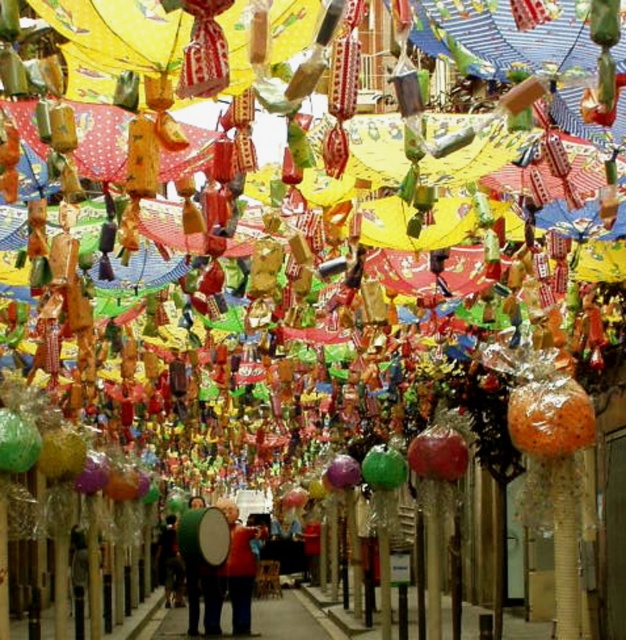
You are standing in the middle of the street looking up at the decorations. Which object is closer to your eyes between the green matte drum at center and the red fabric jacket at center?

The green matte drum at center is closer to the viewer than the red fabric jacket at center.

You are standing in the middle of the street looking towards the buildings. You see a green matte drum at center and a dark brown leather jacket at lower left. Which object is positioned to the right of the other?

The green matte drum at center is to the right of the dark brown leather jacket at lower left.

You are standing in the vibrant street scene and notice a red fabric jacket at center. Where exactly is the red fabric jacket located in terms of coordinates?

The red fabric jacket at center is located at point (239, 566).